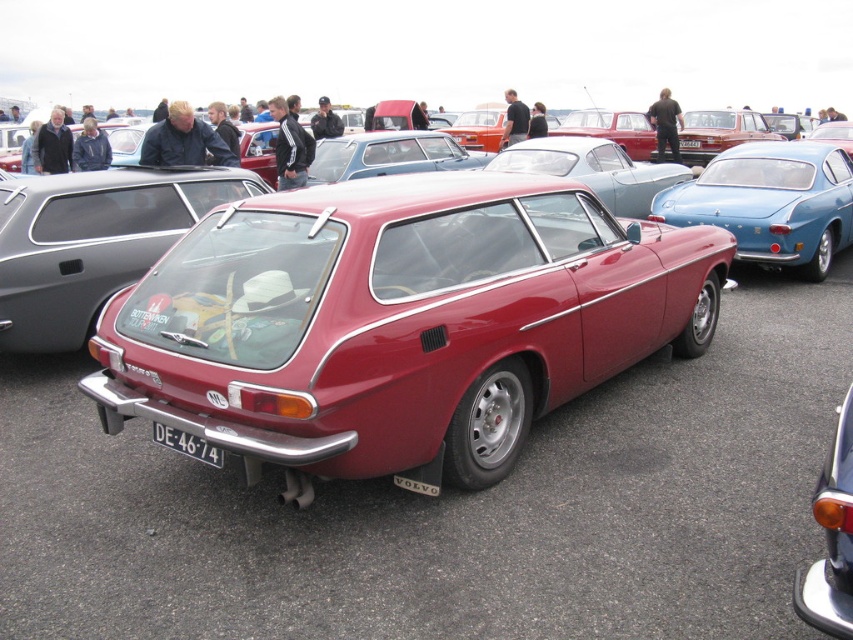
Question: Among these points, which one is nearest to the camera?

Choices:
 (A) (838, 636)
 (B) (53, 349)
 (C) (187, 445)

Answer: (A)

Question: Which point is farther to the camera?

Choices:
 (A) glossy red car at center
 (B) white plastic license plate at lower center
 (C) metallic silver sedan at center
 (D) glossy metallic car at center

Answer: (C)

Question: Can you confirm if glossy red car at center is positioned to the left of metallic silver sedan at center?

Choices:
 (A) yes
 (B) no

Answer: (B)

Question: Does metallic blue car at center have a lesser width compared to glossy red station wagon at center?

Choices:
 (A) no
 (B) yes

Answer: (B)

Question: Which point appears closest to the camera in this image?

Choices:
 (A) pyautogui.click(x=416, y=376)
 (B) pyautogui.click(x=172, y=444)
 (C) pyautogui.click(x=173, y=224)

Answer: (A)

Question: From the image, what is the correct spatial relationship of metallic blue car at center in relation to glossy metallic car at center?

Choices:
 (A) left
 (B) right

Answer: (B)